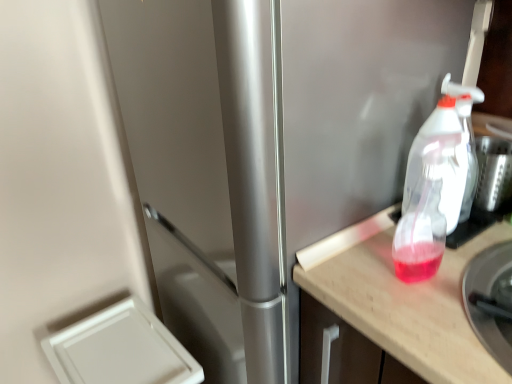
Describe the element at coordinates (120, 349) in the screenshot. I see `white plastic drawer at lower left, acting as the first appliance starting from the back` at that location.

Locate an element on the screen. The width and height of the screenshot is (512, 384). white plastic drawer at lower left, which is counted as the 1th appliance, starting from the bottom is located at coordinates (120, 349).

The image size is (512, 384). Identify the location of transparent plastic spray bottle at right. (449, 150).

At what (x,y) coordinates should I click in order to perform the action: click on translucent plastic spray bottle at right. Please return your answer as a coordinate pair (x, y). The image size is (512, 384). Looking at the image, I should click on (422, 222).

In the scene shown: Measure the distance between metallic silver bowl at right, which is the second appliance from left to right, and camera.

23.11 inches.

Locate an element on the screen. white plastic drawer at lower left, arranged as the 1th appliance when viewed from the left is located at coordinates (120, 349).

Can you confirm if wooden countertop at right is thinner than transparent plastic spray bottle at right?

No.

Would you say transparent plastic spray bottle at right is part of wooden countertop at right's contents?

No, transparent plastic spray bottle at right is not a part of wooden countertop at right.

How different are the orientations of wooden countertop at right and transparent plastic spray bottle at right in degrees?

There is a 1.58-degree angle between the facing directions of wooden countertop at right and transparent plastic spray bottle at right.

Is point (335, 239) closer to camera compared to point (412, 156)?

No, it is not.

Based on the photo, is wooden countertop at right at the left side of translucent plastic spray bottle at right?

Incorrect, wooden countertop at right is not on the left side of translucent plastic spray bottle at right.

Which is behind, point (376, 277) or point (398, 233)?

The point (376, 277) is farther.

Looking at this image, considering the sizes of wooden countertop at right and translucent plastic spray bottle at right in the image, is wooden countertop at right wider or thinner than translucent plastic spray bottle at right?

In the image, wooden countertop at right appears to be wider than translucent plastic spray bottle at right.

Based on the photo, is translucent plastic spray bottle at right at the back of wooden countertop at right?

No, wooden countertop at right is not facing away from translucent plastic spray bottle at right.

Is point (470, 286) positioned after point (434, 276)?

No, it is not.

What's the angular difference between metallic silver bowl at right, which appears as the first appliance when viewed from the right, and wooden countertop at right's facing directions?

There is a 1.58-degree angle between the facing directions of metallic silver bowl at right, which appears as the first appliance when viewed from the right, and wooden countertop at right.

Does metallic silver bowl at right, which is the second appliance from left to right, have a greater height compared to wooden countertop at right?

In fact, metallic silver bowl at right, which is the second appliance from left to right, may be shorter than wooden countertop at right.

From a real-world perspective, does white plastic drawer at lower left, which is counted as the 1th appliance, starting from the bottom, stand above metallic silver bowl at right, which is the second appliance from left to right?

No, from a real-world perspective, white plastic drawer at lower left, which is counted as the 1th appliance, starting from the bottom, is not over metallic silver bowl at right, which is the second appliance from left to right

How far apart are white plastic drawer at lower left, the 2th appliance viewed from the front, and metallic silver bowl at right, the 2th appliance when ordered from back to front?

A distance of 32.36 inches exists between white plastic drawer at lower left, the 2th appliance viewed from the front, and metallic silver bowl at right, the 2th appliance when ordered from back to front.

From the picture: Is white plastic drawer at lower left, the 2th appliance viewed from the front, turned away from metallic silver bowl at right, which ranks as the first appliance in top-to-bottom order?

That's not correct — white plastic drawer at lower left, the 2th appliance viewed from the front, is not looking away from metallic silver bowl at right, which ranks as the first appliance in top-to-bottom order.

Considering the sizes of white plastic drawer at lower left, which is counted as the 1th appliance, starting from the bottom, and metallic silver bowl at right, the 2th appliance when ordered from back to front, in the image, is white plastic drawer at lower left, which is counted as the 1th appliance, starting from the bottom, wider or thinner than metallic silver bowl at right, the 2th appliance when ordered from back to front,?

In the image, white plastic drawer at lower left, which is counted as the 1th appliance, starting from the bottom, appears to be wider than metallic silver bowl at right, the 2th appliance when ordered from back to front.

In terms of height, does transparent plastic spray bottle at right look taller or shorter compared to white plastic drawer at lower left, arranged as the 1th appliance when viewed from the left?

transparent plastic spray bottle at right is shorter than white plastic drawer at lower left, arranged as the 1th appliance when viewed from the left.

Is transparent plastic spray bottle at right further to camera compared to white plastic drawer at lower left, acting as the first appliance starting from the back?

No, the depth of transparent plastic spray bottle at right is less than that of white plastic drawer at lower left, acting as the first appliance starting from the back.

From the image's perspective, is transparent plastic spray bottle at right located above or below white plastic drawer at lower left, arranged as the 1th appliance when viewed from the left?

From the image's perspective, transparent plastic spray bottle at right appears above white plastic drawer at lower left, arranged as the 1th appliance when viewed from the left.

Based on their positions, is translucent plastic spray bottle at right located to the left or right of metallic silver bowl at right, which ranks as the first appliance in top-to-bottom order?

From the image, it's evident that translucent plastic spray bottle at right is to the left of metallic silver bowl at right, which ranks as the first appliance in top-to-bottom order.

From a real-world perspective, between translucent plastic spray bottle at right and metallic silver bowl at right, which is the second appliance from left to right, who is vertically higher?

In real-world perspective, translucent plastic spray bottle at right is above.

Considering the sizes of objects translucent plastic spray bottle at right and metallic silver bowl at right, which ranks as the first appliance in top-to-bottom order, in the image provided, who is bigger, translucent plastic spray bottle at right or metallic silver bowl at right, which ranks as the first appliance in top-to-bottom order,?

Bigger between the two is metallic silver bowl at right, which ranks as the first appliance in top-to-bottom order.

From the image's perspective, which appliance is the 1st one below the translucent plastic spray bottle at right? Please provide its 2D coordinates.

[(490, 300)]

Where is `bottle behind the wooden countertop at right`? This screenshot has height=384, width=512. bottle behind the wooden countertop at right is located at coordinates (422, 222).

Which is farther, [426,203] or [391,272]?

Point [391,272]

Does translucent plastic spray bottle at right lie in front of wooden countertop at right?

No, translucent plastic spray bottle at right is further to the viewer.

From the image's perspective, which object appears higher, translucent plastic spray bottle at right or wooden countertop at right?

From the image's view, translucent plastic spray bottle at right is above.

You are a GUI agent. You are given a task and a screenshot of the screen. Output one action in this format:
    pyautogui.click(x=<x>, y=<y>)
    Task: Click on the countertop on the right of transparent plastic spray bottle at right
    The width and height of the screenshot is (512, 384).
    Given the screenshot: What is the action you would take?
    pyautogui.click(x=402, y=300)

Locate an element on the screen. countertop below the translucent plastic spray bottle at right (from the image's perspective) is located at coordinates (402, 300).

Based on their spatial positions, is translucent plastic spray bottle at right or white plastic drawer at lower left, acting as the first appliance starting from the back, further from wooden countertop at right?

Based on the image, white plastic drawer at lower left, acting as the first appliance starting from the back, appears to be further to wooden countertop at right.

Which object lies further to the anchor point metallic silver bowl at right, which is counted as the 2th appliance, starting from the bottom, transparent plastic spray bottle at right or wooden countertop at right?

The object further to metallic silver bowl at right, which is counted as the 2th appliance, starting from the bottom, is transparent plastic spray bottle at right.

Which object lies further to the anchor point wooden countertop at right, transparent plastic spray bottle at right or white plastic drawer at lower left, which is counted as the 1th appliance, starting from the bottom?

white plastic drawer at lower left, which is counted as the 1th appliance, starting from the bottom.

Considering their positions, is white plastic drawer at lower left, the 2th appliance from the top, positioned further to wooden countertop at right than metallic silver bowl at right, which is counted as the 2th appliance, starting from the bottom?

white plastic drawer at lower left, the 2th appliance from the top, lies further to wooden countertop at right than the other object.

Based on their spatial positions, is wooden countertop at right or transparent plastic spray bottle at right further from translucent plastic spray bottle at right?

wooden countertop at right is positioned further to the anchor translucent plastic spray bottle at right.

When comparing their distances from white plastic drawer at lower left, which is counted as the second appliance, starting from the right, does metallic silver bowl at right, the 2th appliance when ordered from back to front, or wooden countertop at right seem further?

Based on the image, metallic silver bowl at right, the 2th appliance when ordered from back to front, appears to be further to white plastic drawer at lower left, which is counted as the second appliance, starting from the right.

In the scene shown: When comparing their distances from white plastic drawer at lower left, acting as the first appliance starting from the back, does metallic silver bowl at right, which is the second appliance from left to right, or transparent plastic spray bottle at right seem further?

metallic silver bowl at right, which is the second appliance from left to right, lies further to white plastic drawer at lower left, acting as the first appliance starting from the back, than the other object.

Based on their spatial positions, is white plastic drawer at lower left, arranged as the 1th appliance when viewed from the left, or wooden countertop at right closer to translucent plastic spray bottle at right?

The object closer to translucent plastic spray bottle at right is wooden countertop at right.

Locate an element on the screen. This screenshot has height=384, width=512. appliance between translucent plastic spray bottle at right and wooden countertop at right vertically is located at coordinates (490, 300).

This screenshot has width=512, height=384. What are the coordinates of `bottle between transparent plastic spray bottle at right and metallic silver bowl at right, the 2th appliance when ordered from back to front, in the up-down direction` in the screenshot? It's located at tap(422, 222).

You are a GUI agent. You are given a task and a screenshot of the screen. Output one action in this format:
    pyautogui.click(x=<x>, y=<y>)
    Task: Click on the bottle that lies between transparent plastic spray bottle at right and wooden countertop at right from top to bottom
    The height and width of the screenshot is (384, 512).
    Given the screenshot: What is the action you would take?
    pyautogui.click(x=422, y=222)

Find the location of a particular element. The width and height of the screenshot is (512, 384). bottle between white plastic drawer at lower left, which is counted as the 1th appliance, starting from the bottom, and transparent plastic spray bottle at right is located at coordinates (422, 222).